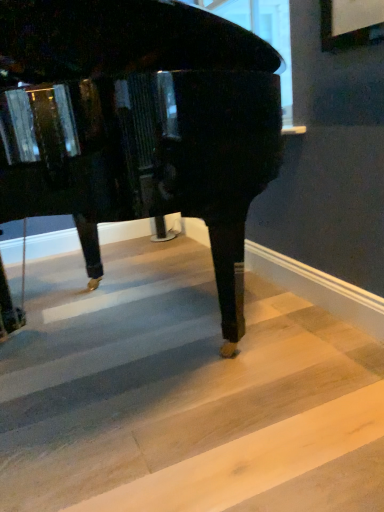
What are the coordinates of `free point below glossy black piano at center (from a real-world perspective)` in the screenshot? It's located at (81, 368).